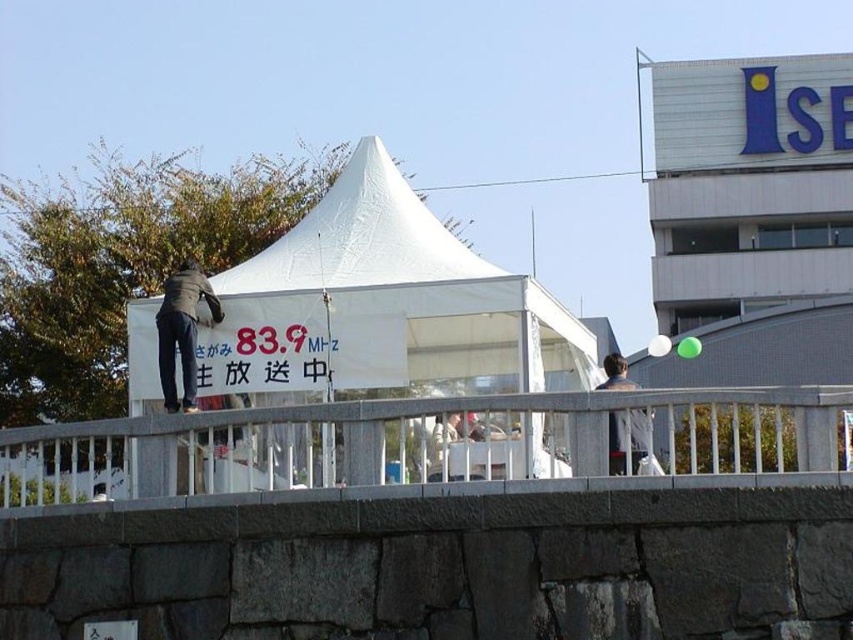
You are a delivery person who needs to place a package between the dark gray jacket at upper center and the light brown leather jacket at center. The package is 6 feet long. Can you fit the package between them without bending it?

The distance between the dark gray jacket at upper center and the light brown leather jacket at center is 7.03 feet. Since the package is 6 feet long, it can fit between them without bending.

You are a photographer trying to capture both the dark gray jacket at upper center and the light brown leather jacket at center in a single frame. Which jacket should you adjust your camera focus to prioritize if you want to ensure the wider jacket is clearly visible?

The dark gray jacket at upper center is wider than the light brown leather jacket at center, so you should prioritize focusing on the dark gray jacket at upper center to ensure its details are clear.